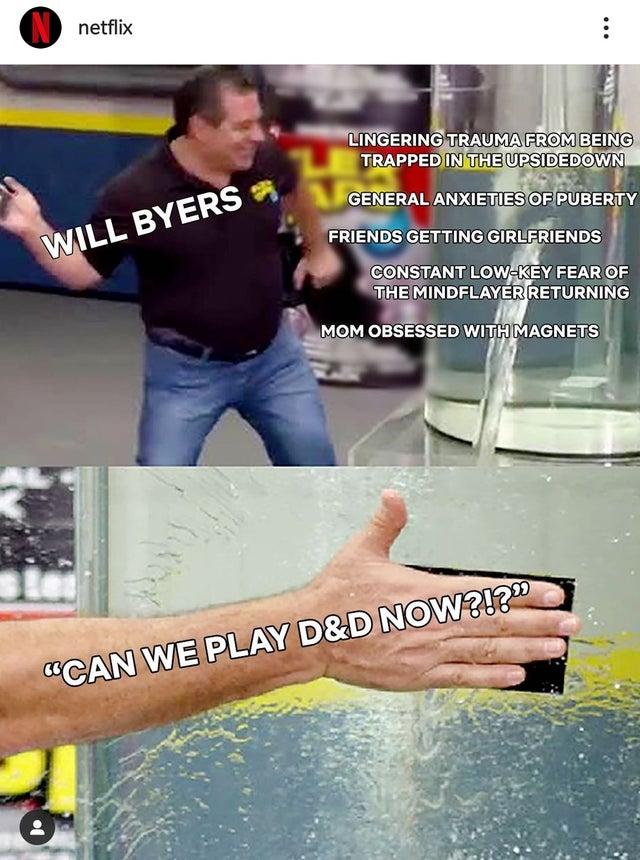
The height and width of the screenshot is (860, 640). What are the coordinates of `tub of water` in the screenshot? It's located at (538, 808), (560, 371).